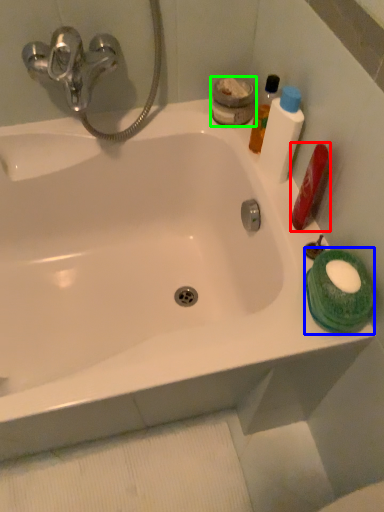
Question: Which object is the closest to the mouthwash (highlighted by a red box)? Choose among these: mouthwash (highlighted by a blue box) or mouthwash (highlighted by a green box).

Choices:
 (A) mouthwash
 (B) mouthwash

Answer: (A)